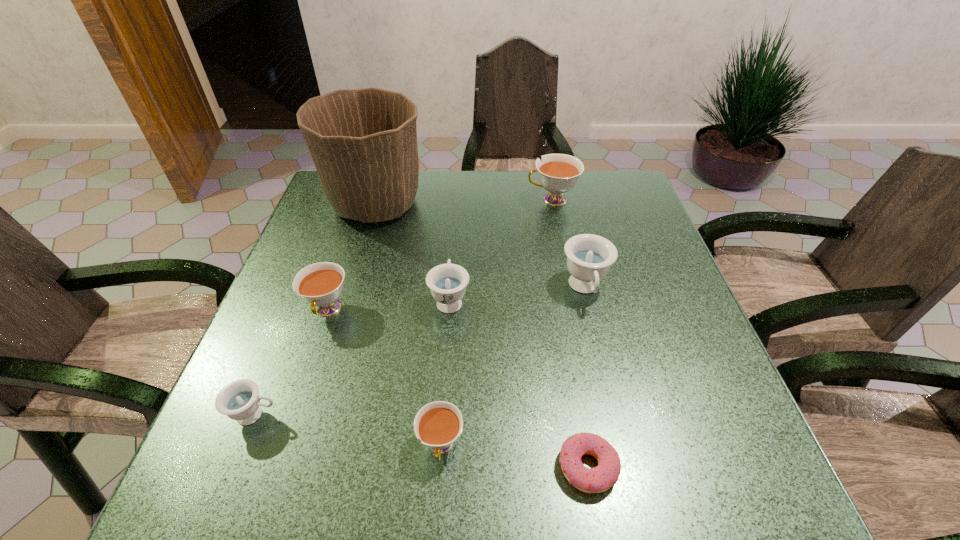
I want to click on the tallest object, so click(363, 142).

This screenshot has width=960, height=540. What are the coordinates of `the farthest teacup` in the screenshot? It's located at (558, 173).

Image resolution: width=960 pixels, height=540 pixels. Find the location of `the biggest white teacup`. the biggest white teacup is located at coordinates (558, 173).

Identify the location of the biggest blue teacup. The height and width of the screenshot is (540, 960). (589, 256).

This screenshot has height=540, width=960. What are the coordinates of `the leftmost white teacup` in the screenshot? It's located at pyautogui.click(x=320, y=284).

Where is `the second biggest white teacup`? the second biggest white teacup is located at coordinates (320, 284).

Identify the location of the second smallest blue teacup. The image size is (960, 540). (447, 282).

Image resolution: width=960 pixels, height=540 pixels. I want to click on the smallest white teacup, so click(438, 424).

Locate an element on the screen. the second white teacup from left to right is located at coordinates (438, 424).

Locate an element on the screen. The image size is (960, 540). the leftmost blue teacup is located at coordinates (239, 400).